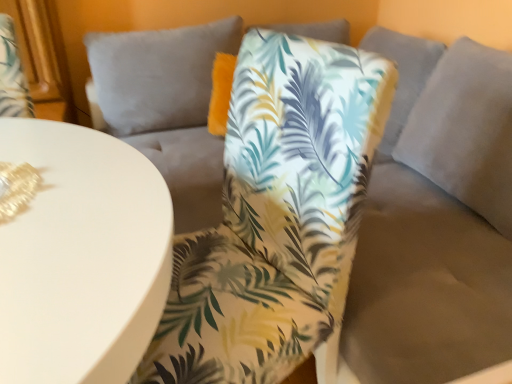
Image resolution: width=512 pixels, height=384 pixels. What do you see at coordinates (81, 257) in the screenshot?
I see `white glossy table at lower left` at bounding box center [81, 257].

This screenshot has width=512, height=384. I want to click on white glossy table at lower left, so click(x=81, y=257).

This screenshot has height=384, width=512. I want to click on palm leaf fabric chair at center, so click(x=276, y=215).

The image size is (512, 384). Describe the element at coordinates (276, 215) in the screenshot. I see `palm leaf fabric chair at center` at that location.

This screenshot has height=384, width=512. In order to click on white glossy table at lower left in this screenshot , I will do coord(81,257).

Which object is positioned more to the left, palm leaf fabric chair at center or white glossy table at lower left?

Positioned to the left is white glossy table at lower left.

Is palm leaf fabric chair at center in front of white glossy table at lower left?

No, palm leaf fabric chair at center is further to the viewer.

Which is closer, (275, 173) or (46, 212)?

The point (46, 212) is more forward.

From the image's perspective, is palm leaf fabric chair at center on white glossy table at lower left?

Yes, from the image's perspective, palm leaf fabric chair at center is on top of white glossy table at lower left.

From a real-world perspective, which object rests below the other?

From a 3D spatial view, white glossy table at lower left is below.

Which object is thinner, palm leaf fabric chair at center or white glossy table at lower left?

palm leaf fabric chair at center is thinner.

Can you confirm if palm leaf fabric chair at center is taller than white glossy table at lower left?

Indeed, palm leaf fabric chair at center has a greater height compared to white glossy table at lower left.

Which of these two, palm leaf fabric chair at center or white glossy table at lower left, is smaller?

palm leaf fabric chair at center is smaller.

Does palm leaf fabric chair at center contain white glossy table at lower left?

Definitely not — white glossy table at lower left is not inside palm leaf fabric chair at center.

Would you say palm leaf fabric chair at center is a long distance from white glossy table at lower left?

That's not correct — palm leaf fabric chair at center is a little close to white glossy table at lower left.

Could you tell me if palm leaf fabric chair at center is turned towards white glossy table at lower left?

Yes, palm leaf fabric chair at center is facing white glossy table at lower left.

The height and width of the screenshot is (384, 512). Find the location of `table that appears below the palm leaf fabric chair at center (from a real-world perspective)`. table that appears below the palm leaf fabric chair at center (from a real-world perspective) is located at coordinates (81, 257).

Which object is positioned more to the right, white glossy table at lower left or palm leaf fabric chair at center?

palm leaf fabric chair at center.

Relative to palm leaf fabric chair at center, is white glossy table at lower left in front or behind?

In the image, white glossy table at lower left appears in front of palm leaf fabric chair at center.

Does point (12, 265) come farther from viewer compared to point (277, 198)?

No, (12, 265) is closer to viewer.

From the image's perspective, relative to palm leaf fabric chair at center, is white glossy table at lower left above or below?

Based on their image positions, white glossy table at lower left is located beneath palm leaf fabric chair at center.

From a real-world perspective, relative to palm leaf fabric chair at center, is white glossy table at lower left vertically above or below?

From a real-world perspective, white glossy table at lower left is physically below palm leaf fabric chair at center.

Looking at their sizes, would you say white glossy table at lower left is wider or thinner than palm leaf fabric chair at center?

white glossy table at lower left is wider than palm leaf fabric chair at center.

Can you confirm if white glossy table at lower left is shorter than palm leaf fabric chair at center?

Indeed, white glossy table at lower left has a lesser height compared to palm leaf fabric chair at center.

Between white glossy table at lower left and palm leaf fabric chair at center, which one has larger size?

white glossy table at lower left.

Would you say white glossy table at lower left contains palm leaf fabric chair at center?

No, white glossy table at lower left does not contain palm leaf fabric chair at center.

Is white glossy table at lower left placed right next to palm leaf fabric chair at center?

white glossy table at lower left and palm leaf fabric chair at center are clearly separated.

Is white glossy table at lower left turned away from palm leaf fabric chair at center?

Yes, white glossy table at lower left's orientation is away from palm leaf fabric chair at center.

How many degrees apart are the facing directions of white glossy table at lower left and palm leaf fabric chair at center?

There is a 20.7-degree angle between the facing directions of white glossy table at lower left and palm leaf fabric chair at center.

Measure the distance between white glossy table at lower left and palm leaf fabric chair at center.

A distance of 30.11 centimeters exists between white glossy table at lower left and palm leaf fabric chair at center.

Locate an element on the screen. table directly beneath the palm leaf fabric chair at center (from a real-world perspective) is located at coordinates (81, 257).

At what (x,y) coordinates should I click in order to perform the action: click on table that appears below the palm leaf fabric chair at center (from the image's perspective). Please return your answer as a coordinate pair (x, y). The image size is (512, 384). Looking at the image, I should click on click(x=81, y=257).

I want to click on chair above the white glossy table at lower left (from the image's perspective), so [276, 215].